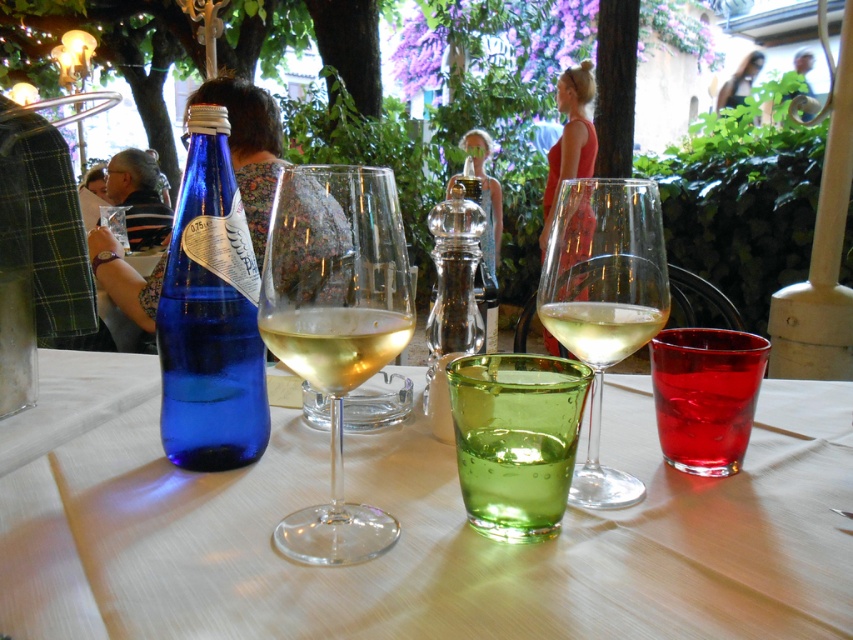
Which is above, green glass at center or clear glass pepper shaker at center?

clear glass pepper shaker at center is above.

The image size is (853, 640). Describe the element at coordinates (515, 440) in the screenshot. I see `green glass at center` at that location.

I want to click on green glass at center, so click(515, 440).

Does blue glass bottle at left appear over clear glass wine at center?

Yes, blue glass bottle at left is above clear glass wine at center.

Is blue glass bottle at left further to camera compared to clear glass wine at center?

Yes, blue glass bottle at left is behind clear glass wine at center.

Does point (235, 461) lie behind point (621, 346)?

That is True.

I want to click on blue glass bottle at left, so click(210, 314).

Between blue glass bottle at left and green glass at center, which one has more height?

blue glass bottle at left is taller.

Can you confirm if blue glass bottle at left is smaller than green glass at center?

No.

At what (x,y) coordinates should I click in order to perform the action: click on blue glass bottle at left. Please return your answer as a coordinate pair (x, y). This screenshot has width=853, height=640. Looking at the image, I should click on (210, 314).